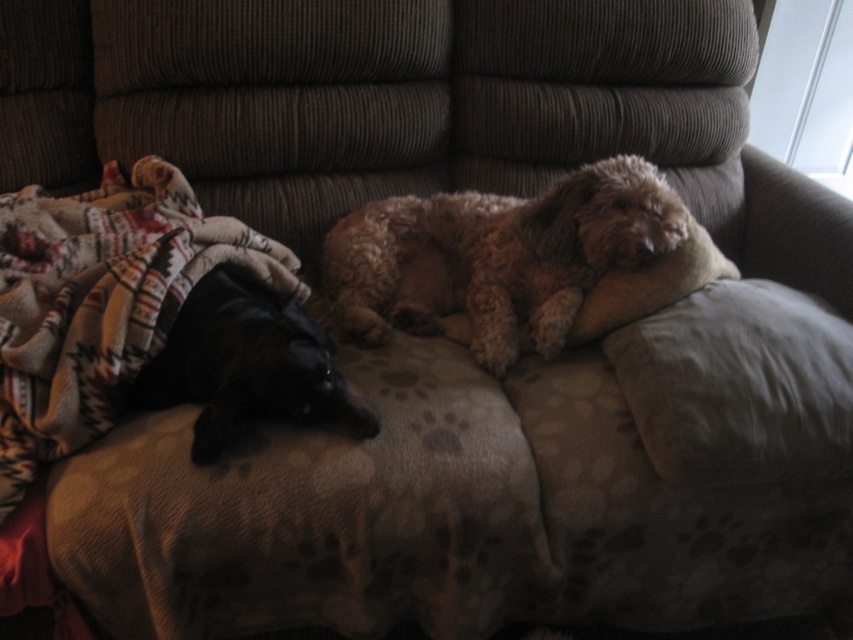
Question: Does fuzzy brown dog at center have a lesser width compared to beige fabric pillow at upper right?

Choices:
 (A) no
 (B) yes

Answer: (A)

Question: From the image, what is the correct spatial relationship of plaid fleece blanket at left in relation to black fur dog at left?

Choices:
 (A) below
 (B) above

Answer: (B)

Question: Which of these objects is positioned closest to the beige fabric pillow at upper right?

Choices:
 (A) fuzzy brown dog at center
 (B) black fur dog at left
 (C) plaid fleece blanket at left
 (D) gray fabric pillow at right

Answer: (D)

Question: Which object appears farthest from the camera in this image?

Choices:
 (A) plaid fleece blanket at left
 (B) beige fabric pillow at upper right

Answer: (B)

Question: Can you confirm if fuzzy brown dog at center is positioned below gray fabric pillow at right?

Choices:
 (A) yes
 (B) no

Answer: (B)

Question: Which object is farther from the camera taking this photo?

Choices:
 (A) plaid fleece blanket at left
 (B) black fur dog at left
 (C) beige fabric pillow at upper right
 (D) fuzzy brown dog at center

Answer: (C)